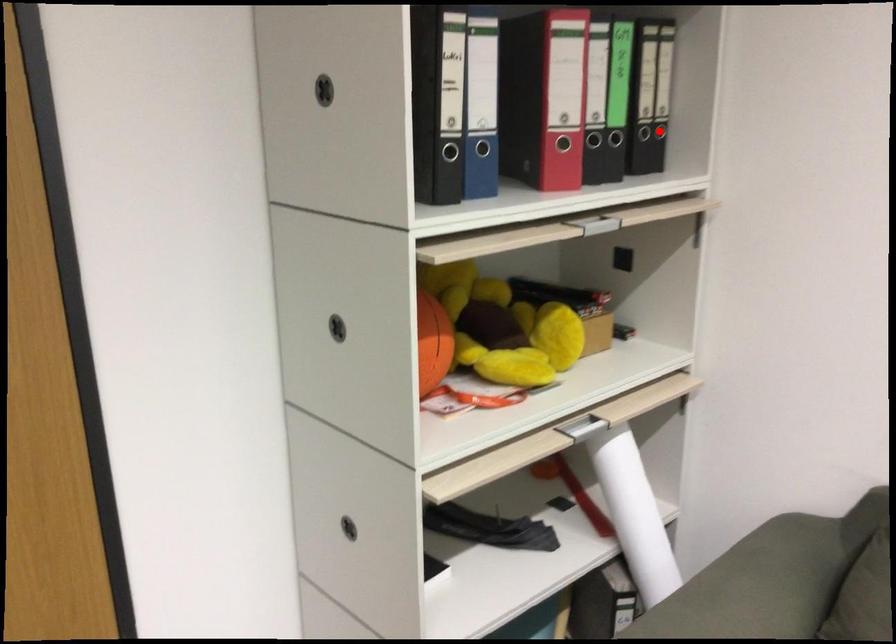
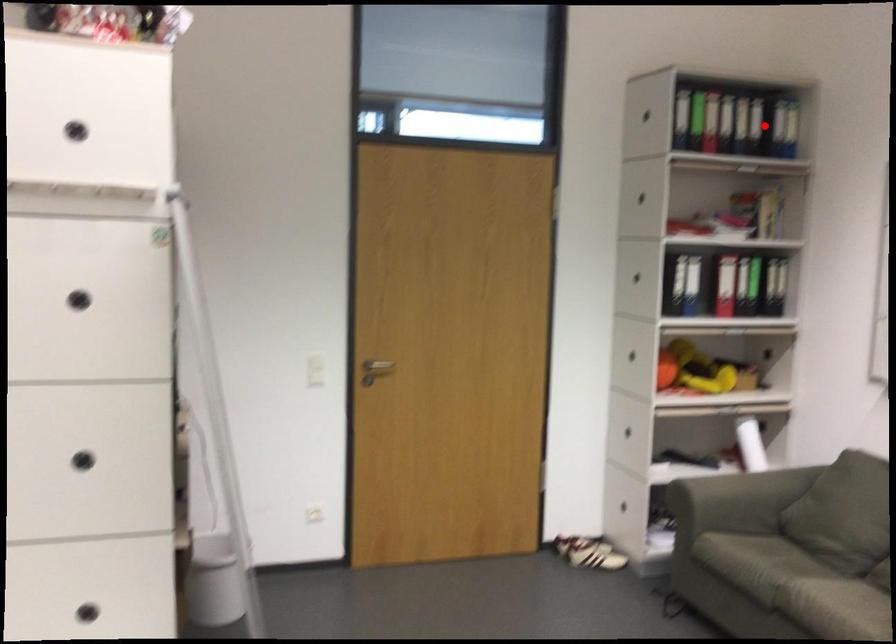
I am providing you with two images of the same scene from different viewpoints. A red point is marked on the first image and another point is marked on the second image. Is the marked point in image1 the same physical position as the marked point in image2?

No